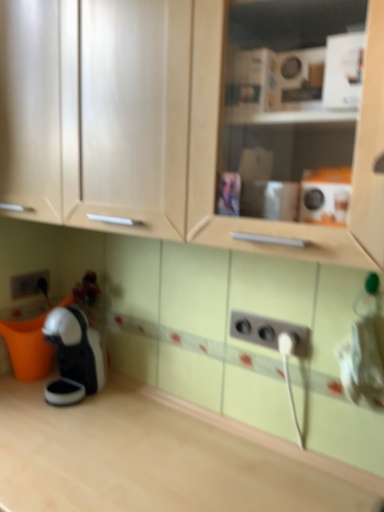
Question: Can you confirm if light wood countertop at lower left is shorter than matte gray electric outlet at lower left, the second electric outlet from the front?

Choices:
 (A) no
 (B) yes

Answer: (A)

Question: Is light wood countertop at lower left behind matte gray electric outlet at lower left, which ranks as the 2th electric outlet in bottom-to-top order?

Choices:
 (A) yes
 (B) no

Answer: (B)

Question: Can you confirm if light wood countertop at lower left is positioned to the right of matte gray electric outlet at lower left, which ranks as the 1th electric outlet in top-to-bottom order?

Choices:
 (A) no
 (B) yes

Answer: (B)

Question: From a real-world perspective, does light wood countertop at lower left stand above matte gray electric outlet at lower left, the second electric outlet from the front?

Choices:
 (A) yes
 (B) no

Answer: (B)

Question: Is light wood countertop at lower left in front of matte gray electric outlet at lower left, which is the 1th electric outlet from back to front?

Choices:
 (A) yes
 (B) no

Answer: (A)

Question: In the image, is matte wood cabinet at upper center positioned in front of or behind matte gray electric outlet at lower left, the second electric outlet from the front?

Choices:
 (A) behind
 (B) front

Answer: (B)

Question: From the image's perspective, is matte wood cabinet at upper center located above or below matte gray electric outlet at lower left, which ranks as the 2th electric outlet in bottom-to-top order?

Choices:
 (A) above
 (B) below

Answer: (A)

Question: In terms of width, does matte wood cabinet at upper center look wider or thinner when compared to matte gray electric outlet at lower left, which is the 1th electric outlet from back to front?

Choices:
 (A) thin
 (B) wide

Answer: (B)

Question: From their relative heights in the image, would you say matte wood cabinet at upper center is taller or shorter than matte gray electric outlet at lower left, the first electric outlet positioned from the left?

Choices:
 (A) short
 (B) tall

Answer: (B)

Question: From a real-world perspective, is white plastic outlet at lower center, the second electric outlet viewed from the left, positioned above or below matte gray electric outlet at lower left, which ranks as the 1th electric outlet in top-to-bottom order?

Choices:
 (A) below
 (B) above

Answer: (B)

Question: Which is correct: white plastic outlet at lower center, which is the second electric outlet in top-to-bottom order, is inside matte gray electric outlet at lower left, which is counted as the second electric outlet, starting from the right, or outside of it?

Choices:
 (A) inside
 (B) outside

Answer: (B)

Question: Considering the positions of point (281, 325) and point (26, 282), is point (281, 325) closer or farther from the camera than point (26, 282)?

Choices:
 (A) closer
 (B) farther

Answer: (A)

Question: Is white plastic outlet at lower center, acting as the first electric outlet starting from the bottom, wider or thinner than matte gray electric outlet at lower left, which is the 1th electric outlet from back to front?

Choices:
 (A) wide
 (B) thin

Answer: (A)

Question: Relative to light wood countertop at lower left, is matte gray electric outlet at lower left, which ranks as the 1th electric outlet in top-to-bottom order, in front or behind?

Choices:
 (A) front
 (B) behind

Answer: (B)

Question: Considering the positions of matte gray electric outlet at lower left, the first electric outlet positioned from the left, and light wood countertop at lower left in the image, is matte gray electric outlet at lower left, the first electric outlet positioned from the left, wider or thinner than light wood countertop at lower left?

Choices:
 (A) thin
 (B) wide

Answer: (A)